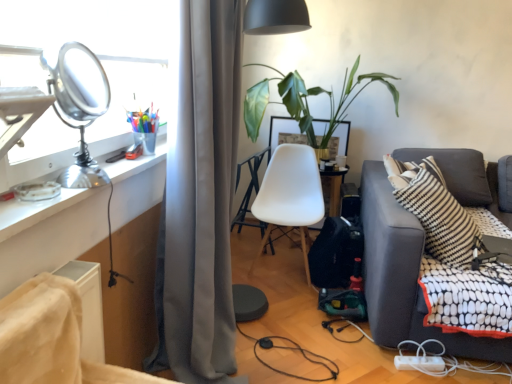
I want to click on vacant area that lies to the right of white plastic power strip at lower right, so click(x=448, y=367).